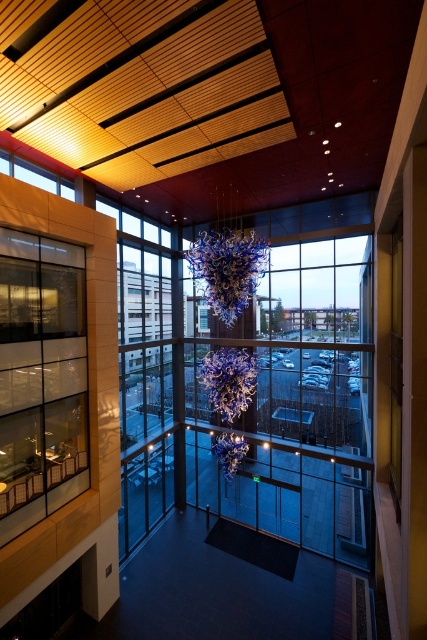
Does clear glass window at left have a smaller size compared to transparent glass window at upper left?

Actually, clear glass window at left might be larger than transparent glass window at upper left.

Is clear glass window at left shorter than transparent glass window at upper left?

No, clear glass window at left is not shorter than transparent glass window at upper left.

Is point (31, 504) farther from viewer compared to point (23, 170)?

No, it is in front of (23, 170).

The image size is (427, 640). What are the coordinates of `clear glass window at left` in the screenshot? It's located at (40, 378).